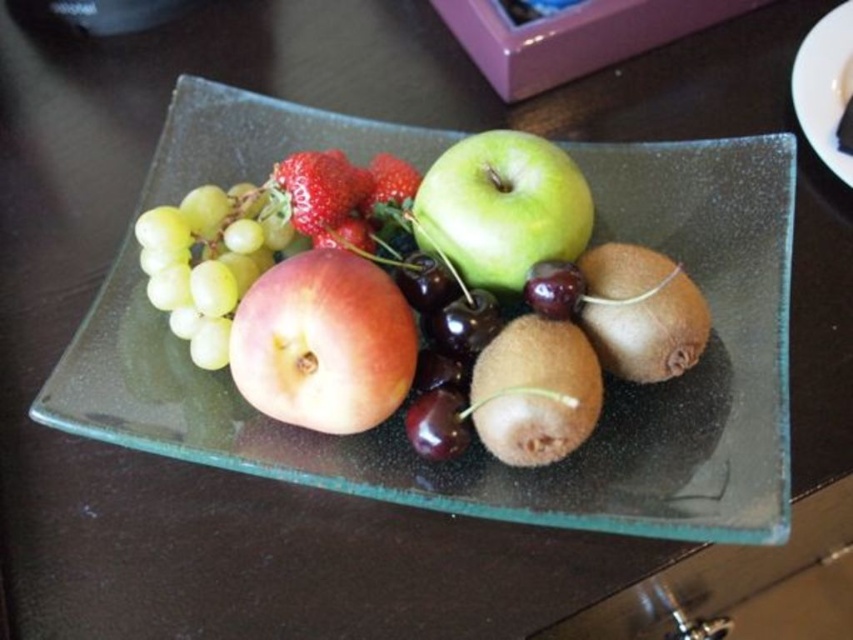
You are arranging fruits on a rectangular glass plate. You have a green matte apple at center. Where should you place it so that it is centered on the plate?

The green matte apple at center should be placed at the point (502, 208) to be centered on the plate according to the coordinates provided.